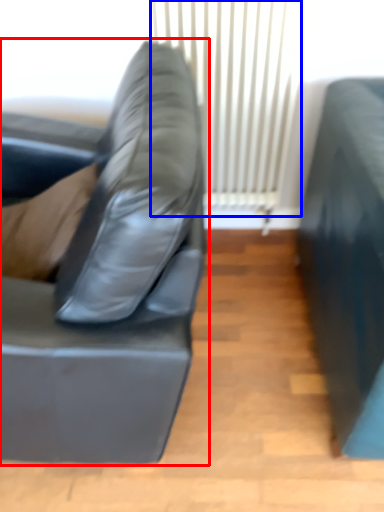
Question: Which object appears closest to the camera in this image, studio couch (highlighted by a red box) or curtain (highlighted by a blue box)?

Choices:
 (A) studio couch
 (B) curtain

Answer: (A)